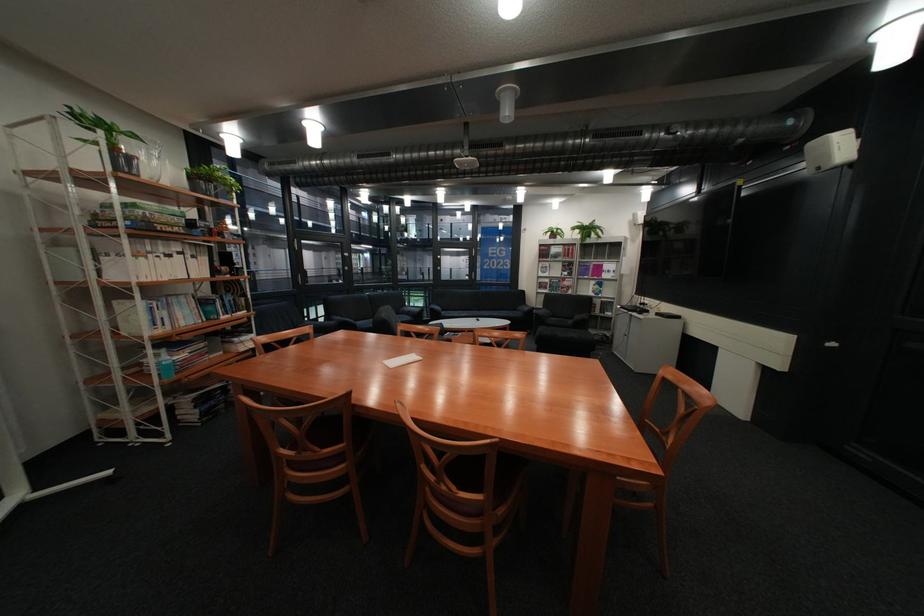
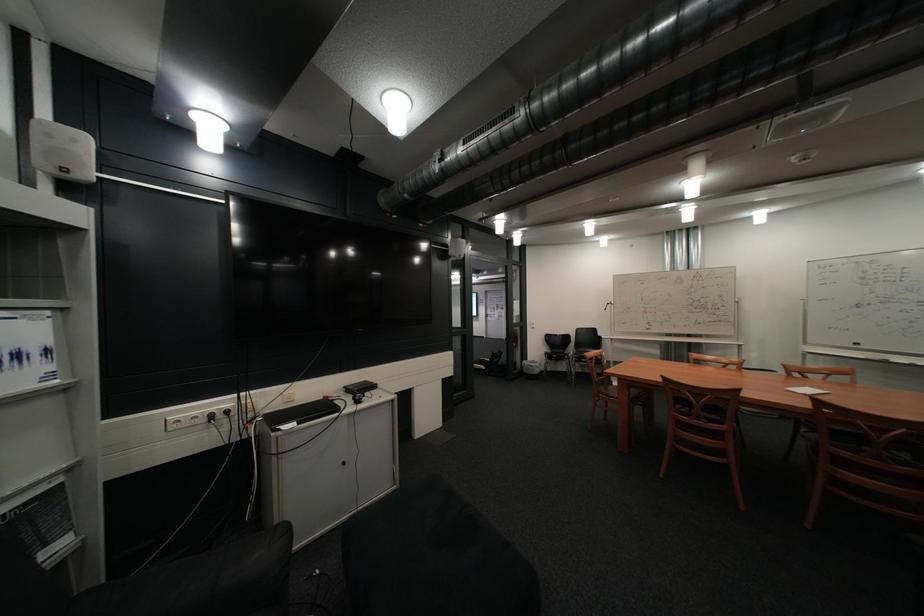
Where in the second image is the point corresponding to (617,300) from the first image?

(10, 514)